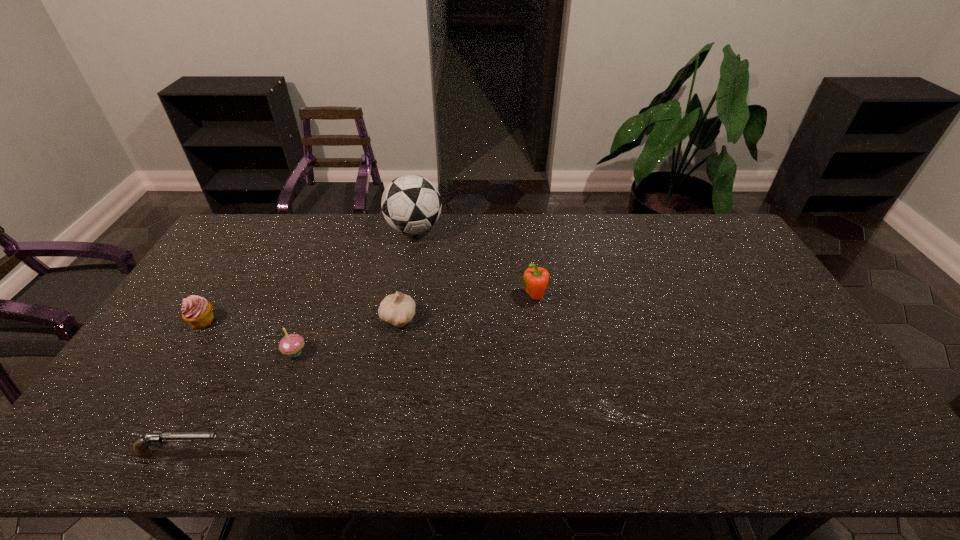
Identify the location of vacant area that lies between the left cupcake and the soccer ball. point(308,275).

Where is `free area in between the gun and the fourth object from right to left`? The image size is (960, 540). free area in between the gun and the fourth object from right to left is located at coordinates (239, 403).

The image size is (960, 540). I want to click on free area in between the fifth object from right to left and the leftmost object, so click(193, 387).

Identify the location of vacant area that lies between the fourth object from right to left and the left cupcake. (249, 336).

The width and height of the screenshot is (960, 540). I want to click on free space between the pepper and the leftmost object, so click(369, 309).

Where is `empty space between the tallest object and the fourth object from right to left`? The width and height of the screenshot is (960, 540). empty space between the tallest object and the fourth object from right to left is located at coordinates (355, 291).

Locate an element on the screen. The height and width of the screenshot is (540, 960). vacant space that's between the fourth object from right to left and the farthest object is located at coordinates (355, 291).

The width and height of the screenshot is (960, 540). I want to click on object that is the closest one to the farthest object, so click(x=398, y=309).

Locate which object is the third closest to the rightmost object. Please provide its 2D coordinates. Your answer should be formatted as a tuple, i.e. [(x, y)], where the tuple contains the x and y coordinates of a point satisfying the conditions above.

[(292, 344)]

The width and height of the screenshot is (960, 540). Identify the location of free location that satisfies the following two spatial constraints: 1. on the back side of the farther cupcake; 2. on the left side of the fifth shortest object. (217, 298).